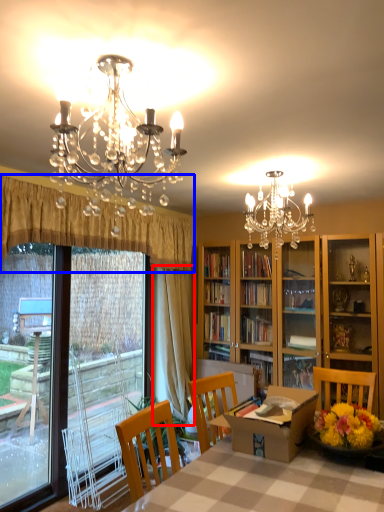
Question: Which of the following is the closest to the observer, curtain (highlighted by a red box) or curtain (highlighted by a blue box)?

Choices:
 (A) curtain
 (B) curtain

Answer: (B)